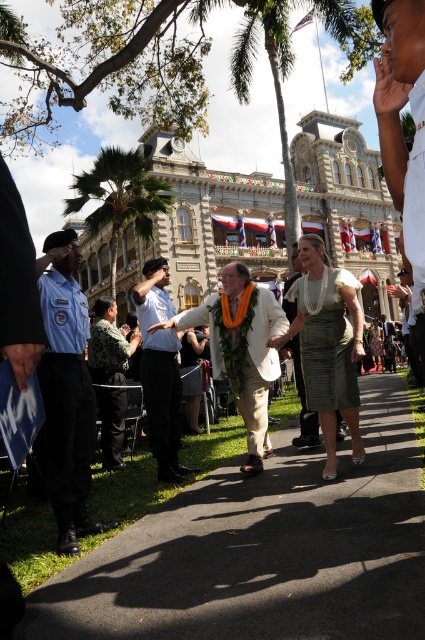
You are organizing a photo shoot for a fashion magazine and need to ensure that the models wearing the white textured suit at center and the camouflage fabric uniform at left are positioned appropriately. Based on their sizes, which outfit should be placed in a spot where it can be more prominently displayed?

The white textured suit at center is bigger than the camouflage fabric uniform at left, so it should be placed in a prominent spot to showcase its size effectively.

You are a photographer at the event and want to capture a photo of both the light blue uniform at left and the white textured suit at center. Based on their positions, which one should you focus on first to ensure both are in frame?

The light blue uniform at left is positioned on the left side of white textured suit at center, so you should focus on the white textured suit at center first to ensure both are in frame.